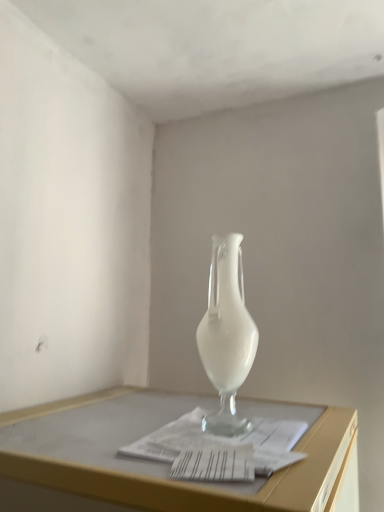
Where is `free point above white paper at center (from a real-world perspective)`? This screenshot has width=384, height=512. free point above white paper at center (from a real-world perspective) is located at coordinates (217, 429).